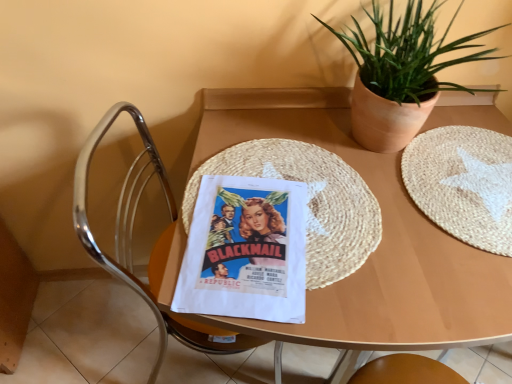
Locate an element on the screen. The image size is (512, 384). vacant area that lies between green leafy plant in clay pot at upper right and woven straw mat at center is located at coordinates (377, 180).